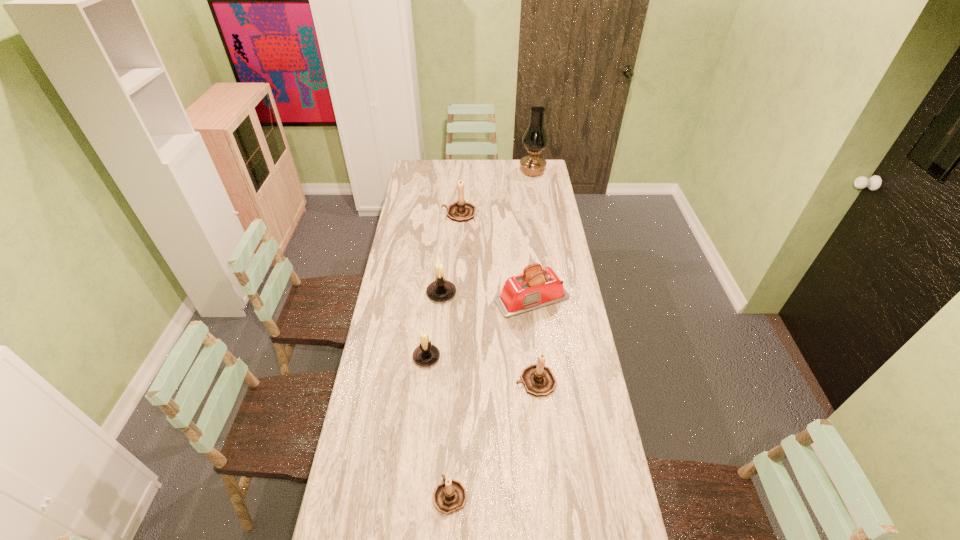
In order to click on free space between the sixth nearest object and the second farthest candle holder in this screenshot , I will do `click(450, 253)`.

The width and height of the screenshot is (960, 540). I want to click on free spot between the fourth nearest candle holder and the red toaster, so click(x=487, y=296).

At what (x,y) coordinates should I click in order to perform the action: click on object that can be found as the second closest to the farthest candle holder. Please return your answer as a coordinate pair (x, y). Looking at the image, I should click on (440, 290).

Select which object is the closest to the bigger white candle holder. Please provide its 2D coordinates. Your answer should be formatted as a tuple, i.e. [(x, y)], where the tuple contains the x and y coordinates of a point satisfying the conditions above.

[(537, 287)]

Point out which candle holder is positioned as the second nearest to the nearer white candle holder. Please provide its 2D coordinates. Your answer should be formatted as a tuple, i.e. [(x, y)], where the tuple contains the x and y coordinates of a point satisfying the conditions above.

[(538, 380)]

You are a GUI agent. You are given a task and a screenshot of the screen. Output one action in this format:
    pyautogui.click(x=<x>, y=<y>)
    Task: Click on the candle holder that is the closest to the fourth nearest candle holder
    Image resolution: width=960 pixels, height=540 pixels.
    Given the screenshot: What is the action you would take?
    pyautogui.click(x=426, y=354)

I want to click on the closest brown candle holder to the nearest object, so click(x=538, y=380).

Locate which brown candle holder is the third closest to the toaster. Please provide its 2D coordinates. Your answer should be formatted as a tuple, i.e. [(x, y)], where the tuple contains the x and y coordinates of a point satisfying the conditions above.

[(450, 496)]

You are a GUI agent. You are given a task and a screenshot of the screen. Output one action in this format:
    pyautogui.click(x=<x>, y=<y>)
    Task: Click on the white candle holder identified as the closest to the nearest candle holder
    This screenshot has height=540, width=960.
    Given the screenshot: What is the action you would take?
    pyautogui.click(x=426, y=354)

Identify the location of white candle holder that is the closest one to the second farthest brown candle holder. (426, 354).